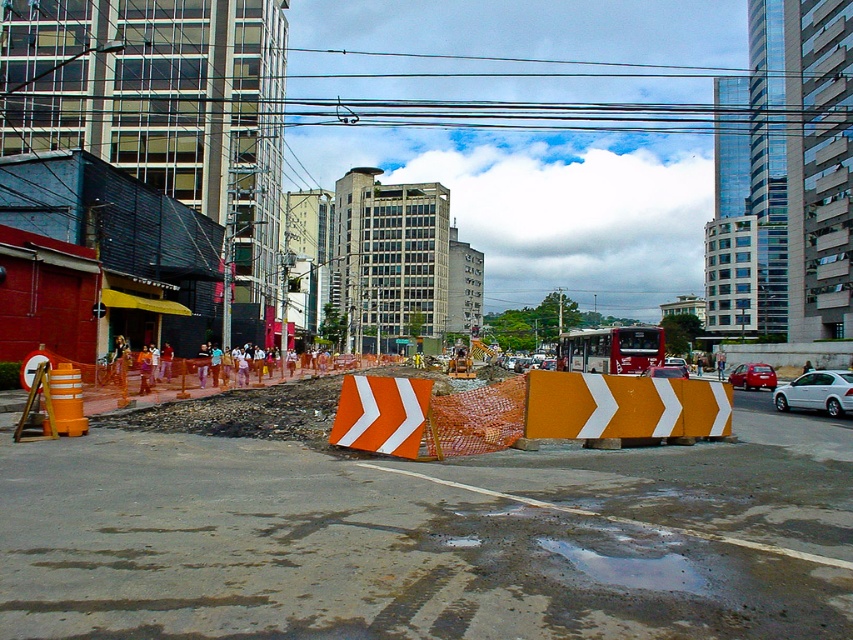
Question: Does orange plastic barricades at center have a lesser width compared to yellow matte barricade at center?

Choices:
 (A) no
 (B) yes

Answer: (A)

Question: Does orange plastic barricades at center come in front of yellow matte barricade at center?

Choices:
 (A) no
 (B) yes

Answer: (B)

Question: Considering the real-world distances, which object is closest to the white matte sedan at center-right?

Choices:
 (A) metallic red sedan at center right
 (B) yellow matte barricade at center
 (C) orange plastic barricades at center

Answer: (A)

Question: Based on their relative distances, which object is farther from the yellow matte barricade at center?

Choices:
 (A) white matte sedan at center-right
 (B) orange plastic barricades at center
 (C) metallic red sedan at center right

Answer: (C)

Question: Is orange plastic barricades at center thinner than metallic red sedan at center right?

Choices:
 (A) no
 (B) yes

Answer: (A)

Question: Which object is positioned closest to the white matte sedan at center-right?

Choices:
 (A) yellow matte barricade at center
 (B) orange plastic barricades at center

Answer: (A)